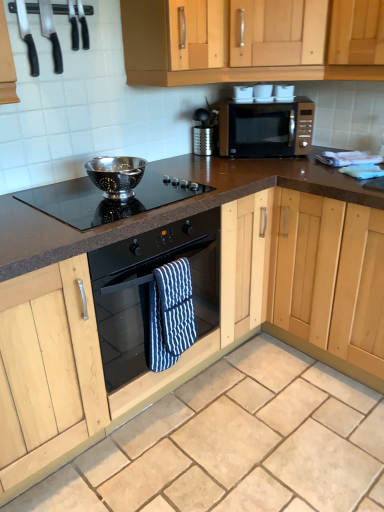
Where is `free location above black glass cooktop at center (from a real-world perspective)`? The image size is (384, 512). free location above black glass cooktop at center (from a real-world perspective) is located at coordinates (97, 195).